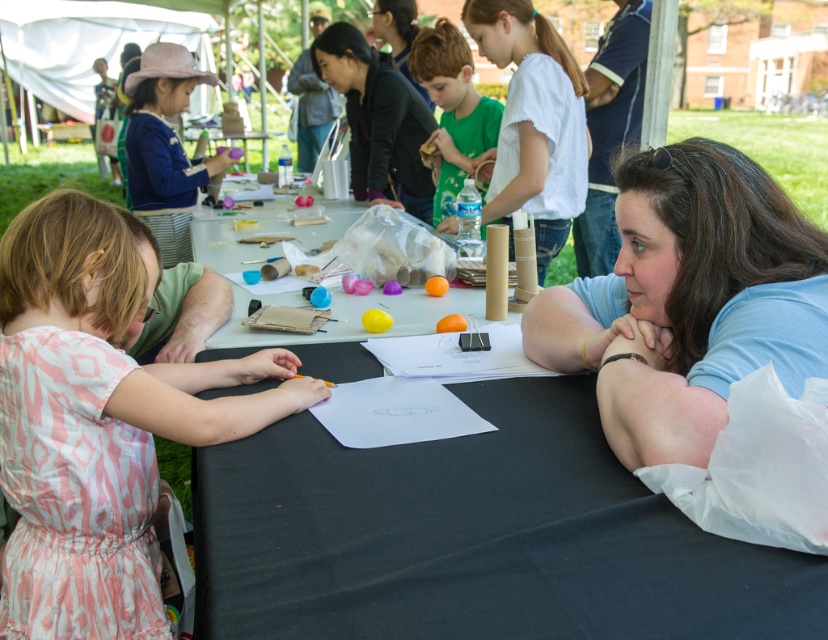
Is blue shirt at center taller than white cotton shirt at upper center?

No.

Is blue shirt at center below white cotton shirt at upper center?

Indeed, blue shirt at center is positioned under white cotton shirt at upper center.

Describe the element at coordinates (687, 300) in the screenshot. The image size is (828, 640). I see `blue shirt at center` at that location.

You are a GUI agent. You are given a task and a screenshot of the screen. Output one action in this format:
    pyautogui.click(x=<x>, y=<y>)
    Task: Click on the blue shirt at center
    
    Given the screenshot: What is the action you would take?
    pyautogui.click(x=687, y=300)

Which of these two, black paper at center or pink cotton dress at left, stands taller?

pink cotton dress at left

Is point (551, 451) farther from viewer compared to point (102, 365)?

That is False.

Between point (289, 348) and point (142, 538), which one is positioned behind?

Positioned behind is point (289, 348).

At what (x,y) coordinates should I click in order to perform the action: click on black paper at center. Please return your answer as a coordinate pair (x, y). Looking at the image, I should click on (473, 536).

Can you confirm if pink cotton dress at left is taller than green matte shirt at center?

Incorrect, pink cotton dress at left's height is not larger of green matte shirt at center's.

Is pink cotton dress at left closer to camera compared to green matte shirt at center?

That is True.

Between point (143, 371) and point (451, 54), which one is positioned in front?

Point (143, 371)

Identify the location of pink cotton dress at left. This screenshot has width=828, height=640. (99, 419).